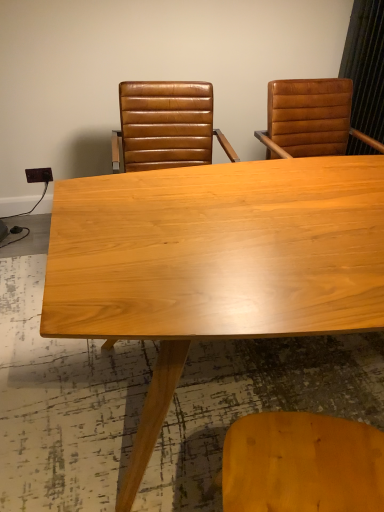
Question: Is light wood table at center outside of brown leather chair at upper center, which ranks as the 2th chair in right-to-left order?

Choices:
 (A) yes
 (B) no

Answer: (A)

Question: Could you tell me if light wood table at center is facing brown leather chair at upper center, which ranks as the 2th chair in right-to-left order?

Choices:
 (A) yes
 (B) no

Answer: (B)

Question: Is light wood table at center touching brown leather chair at upper center, which appears as the first chair when viewed from the left?

Choices:
 (A) no
 (B) yes

Answer: (A)

Question: From the image's perspective, is light wood table at center beneath brown leather chair at upper center, which appears as the first chair when viewed from the left?

Choices:
 (A) no
 (B) yes

Answer: (B)

Question: Is light wood table at center positioned in front of brown leather chair at upper center, which ranks as the 2th chair in right-to-left order?

Choices:
 (A) yes
 (B) no

Answer: (A)

Question: From a real-world perspective, is light wood table at center beneath brown leather chair at upper center, which appears as the first chair when viewed from the left?

Choices:
 (A) no
 (B) yes

Answer: (B)

Question: Does brown leather chair at upper center, which appears as the first chair when viewed from the left, have a greater height compared to light wood table at center?

Choices:
 (A) yes
 (B) no

Answer: (B)

Question: From the image's perspective, is brown leather chair at upper center, which appears as the first chair when viewed from the left, above light wood table at center?

Choices:
 (A) no
 (B) yes

Answer: (B)

Question: Considering the relative sizes of brown leather chair at upper center, which ranks as the 2th chair in right-to-left order, and light wood table at center in the image provided, is brown leather chair at upper center, which ranks as the 2th chair in right-to-left order, smaller than light wood table at center?

Choices:
 (A) no
 (B) yes

Answer: (B)

Question: Does brown leather chair at upper center, which ranks as the 2th chair in right-to-left order, have a lesser height compared to light wood table at center?

Choices:
 (A) yes
 (B) no

Answer: (A)

Question: Is brown leather chair at upper center, which ranks as the 2th chair in right-to-left order, positioned with its back to light wood table at center?

Choices:
 (A) no
 (B) yes

Answer: (A)

Question: From a real-world perspective, is brown leather chair at upper center, which ranks as the 2th chair in right-to-left order, physically above light wood table at center?

Choices:
 (A) no
 (B) yes

Answer: (B)

Question: From the image's perspective, is leather at right, the 1th chair when ordered from right to left, over brown leather chair at upper center, which ranks as the 2th chair in right-to-left order?

Choices:
 (A) no
 (B) yes

Answer: (B)